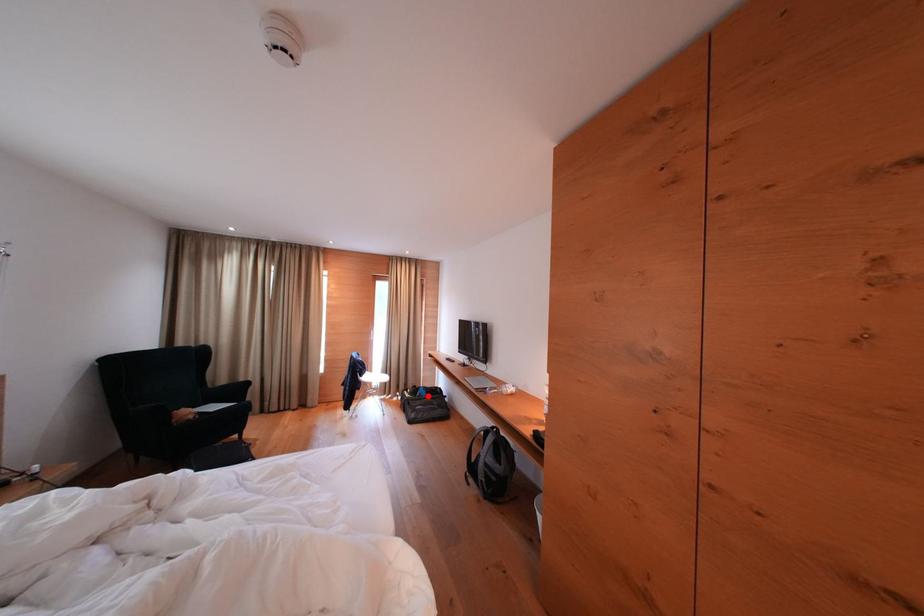
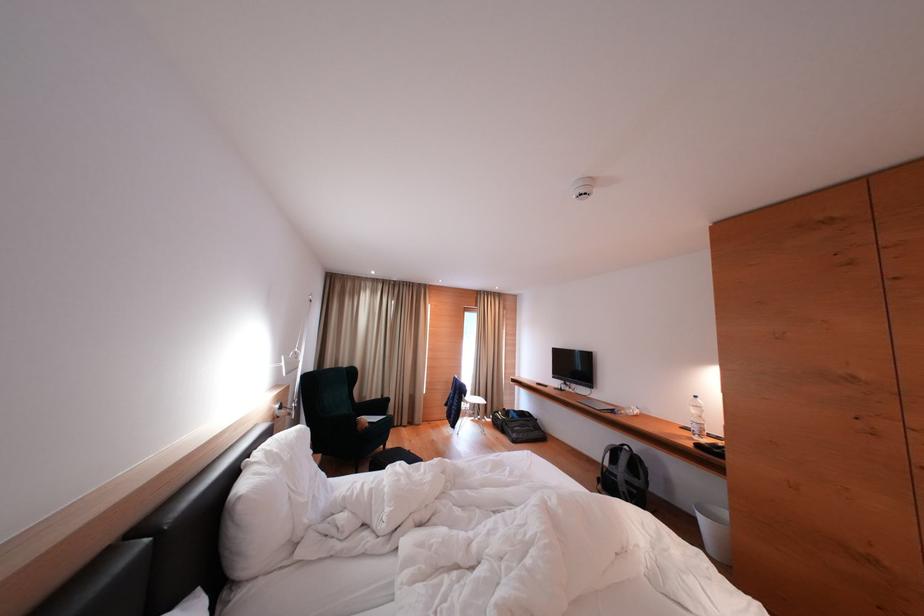
The point at the highlighted location is marked in the first image. Where is the corresponding point in the second image?

(518, 418)